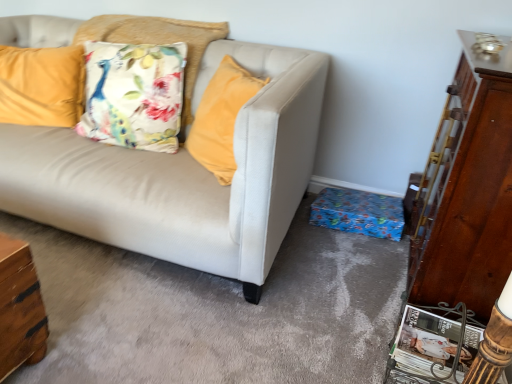
Looking at this image, in order to face floral fabric pillow at upper left, the first pillow viewed from the right, should I rotate leftwards or rightwards?

You should rotate left by 15.099 degrees.

Consider the image. Measure the distance between point (25, 68) and camera.

The depth of point (25, 68) is 2.17 meters.

In order to click on wooden dresser at right in this screenshot , I will do `click(467, 189)`.

In order to face wooden dresser at right, should I rotate leftwards or rightwards?

Turn right by 27.854 degrees to look at wooden dresser at right.

Locate an element on the screen. The width and height of the screenshot is (512, 384). floral fabric pillow at upper left, which is the 2th pillow from left to right is located at coordinates pyautogui.click(x=158, y=43).

Consider the image. Which object is closer to the camera taking this photo, velvet yellow pillow at upper left, the 2th pillow in the right-to-left sequence, or floral fabric pillow at upper left, the first pillow viewed from the right?

floral fabric pillow at upper left, the first pillow viewed from the right, is more forward.

From the picture: Could you measure the distance between velvet yellow pillow at upper left, the 2th pillow in the right-to-left sequence, and floral fabric pillow at upper left, the first pillow viewed from the right?

velvet yellow pillow at upper left, the 2th pillow in the right-to-left sequence, is 14.18 inches from floral fabric pillow at upper left, the first pillow viewed from the right.

Can you confirm if velvet yellow pillow at upper left, the 2th pillow in the right-to-left sequence, is bigger than floral fabric pillow at upper left, which is the 2th pillow from left to right?

No.

Is velvet yellow pillow at upper left, the 1th pillow from the left, surrounding floral fabric pillow at upper left, the first pillow viewed from the right?

No, floral fabric pillow at upper left, the first pillow viewed from the right, is not inside velvet yellow pillow at upper left, the 1th pillow from the left.

Would you consider floral fabric pillow at upper left, which is the 2th pillow from left to right, to be distant from velvet yellow pillow at upper left, the 2th pillow in the right-to-left sequence?

No, floral fabric pillow at upper left, which is the 2th pillow from left to right, is not far away from velvet yellow pillow at upper left, the 2th pillow in the right-to-left sequence.

Looking at this image, what's the angular difference between floral fabric pillow at upper left, the first pillow viewed from the right, and velvet yellow pillow at upper left, the 1th pillow from the left,'s facing directions?

The angle between the facing direction of floral fabric pillow at upper left, the first pillow viewed from the right, and the facing direction of velvet yellow pillow at upper left, the 1th pillow from the left, is 14.2 degrees.

From a real-world perspective, which is physically below, floral fabric pillow at upper left, which is the 2th pillow from left to right, or velvet yellow pillow at upper left, the 2th pillow in the right-to-left sequence?

In real-world perspective, velvet yellow pillow at upper left, the 2th pillow in the right-to-left sequence, is lower.

Is floral fabric pillow at upper left, which is the 2th pillow from left to right, wider or thinner than velvet yellow pillow at upper left, the 2th pillow in the right-to-left sequence?

Considering their sizes, floral fabric pillow at upper left, which is the 2th pillow from left to right, looks broader than velvet yellow pillow at upper left, the 2th pillow in the right-to-left sequence.

From a real-world perspective, is wooden dresser at right above or below floral fabric pillow at upper left, which is the 2th pillow from left to right?

wooden dresser at right is situated lower than floral fabric pillow at upper left, which is the 2th pillow from left to right, in the real world.

Can you confirm if wooden dresser at right is bigger than floral fabric pillow at upper left, which is the 2th pillow from left to right?

Correct, wooden dresser at right is larger in size than floral fabric pillow at upper left, which is the 2th pillow from left to right.

Considering the points (477, 177) and (160, 29), which point is behind, point (477, 177) or point (160, 29)?

The point (160, 29) is more distant.

Are wooden dresser at right and floral fabric pillow at upper left, the first pillow viewed from the right, beside each other?

No, wooden dresser at right is not next to floral fabric pillow at upper left, the first pillow viewed from the right.

How distant is wooden dresser at right from velvet yellow pillow at upper left, the 1th pillow from the left?

wooden dresser at right and velvet yellow pillow at upper left, the 1th pillow from the left, are 1.84 meters apart from each other.

Considering the points (486, 295) and (69, 48), which point is in front, point (486, 295) or point (69, 48)?

The point (486, 295) is in front.

Find the location of a particular element. This screenshot has height=384, width=512. dresser in front of the velvet yellow pillow at upper left, the 1th pillow from the left is located at coordinates pyautogui.click(x=467, y=189).

Is velvet yellow pillow at upper left, the 1th pillow from the left, surrounded by wooden dresser at right?

That's incorrect, velvet yellow pillow at upper left, the 1th pillow from the left, is not inside wooden dresser at right.

From the image's perspective, between velvet yellow pillow at upper left, the 2th pillow in the right-to-left sequence, and wooden dresser at right, who is located below?

From the image's view, wooden dresser at right is below.

Which object is wider, velvet yellow pillow at upper left, the 2th pillow in the right-to-left sequence, or wooden dresser at right?

Wider between the two is velvet yellow pillow at upper left, the 2th pillow in the right-to-left sequence.

Considering the relative sizes of velvet yellow pillow at upper left, the 1th pillow from the left, and wooden dresser at right in the image provided, is velvet yellow pillow at upper left, the 1th pillow from the left, bigger than wooden dresser at right?

No.

Does point (75, 61) come closer to viewer compared to point (504, 280)?

No, (75, 61) is further to viewer.

Is floral fabric pillow at upper left, which is the 2th pillow from left to right, far away from wooden dresser at right?

Absolutely, floral fabric pillow at upper left, which is the 2th pillow from left to right, is distant from wooden dresser at right.

Which is behind, point (214, 24) or point (489, 302)?

The point (214, 24) is farther from the camera.

From a real-world perspective, does floral fabric pillow at upper left, the first pillow viewed from the right, stand above wooden dresser at right?

Yes, from a real-world perspective, floral fabric pillow at upper left, the first pillow viewed from the right, is over wooden dresser at right

Is floral fabric pillow at upper left, the first pillow viewed from the right, taller than wooden dresser at right?

No, floral fabric pillow at upper left, the first pillow viewed from the right, is not taller than wooden dresser at right.

At what (x,y) coordinates should I click in order to perform the action: click on pillow in front of the velvet yellow pillow at upper left, the 1th pillow from the left. Please return your answer as a coordinate pair (x, y). Looking at the image, I should click on pyautogui.click(x=158, y=43).

The width and height of the screenshot is (512, 384). I want to click on pillow that is on the right side of velvet yellow pillow at upper left, the 1th pillow from the left, so (x=158, y=43).

When comparing their distances from velvet yellow pillow at upper left, the 2th pillow in the right-to-left sequence, does floral fabric pillow at upper left, which is the 2th pillow from left to right, or wooden dresser at right seem closer?

Among the two, floral fabric pillow at upper left, which is the 2th pillow from left to right, is located nearer to velvet yellow pillow at upper left, the 2th pillow in the right-to-left sequence.

Considering their positions, is wooden dresser at right positioned closer to velvet yellow pillow at upper left, the 2th pillow in the right-to-left sequence, than floral fabric pillow at upper left, the first pillow viewed from the right?

Based on the image, floral fabric pillow at upper left, the first pillow viewed from the right, appears to be nearer to velvet yellow pillow at upper left, the 2th pillow in the right-to-left sequence.

Estimate the real-world distances between objects in this image. Which object is closer to floral fabric pillow at upper left, the first pillow viewed from the right, wooden dresser at right or velvet yellow pillow at upper left, the 1th pillow from the left?

velvet yellow pillow at upper left, the 1th pillow from the left.

From the image, which object appears to be nearer to wooden dresser at right, velvet yellow pillow at upper left, the 2th pillow in the right-to-left sequence, or floral fabric pillow at upper left, the first pillow viewed from the right?

floral fabric pillow at upper left, the first pillow viewed from the right, is positioned closer to the anchor wooden dresser at right.

Which object lies nearer to the anchor point wooden dresser at right, floral fabric pillow at upper left, which is the 2th pillow from left to right, or velvet yellow pillow at upper left, the 2th pillow in the right-to-left sequence?

floral fabric pillow at upper left, which is the 2th pillow from left to right, lies closer to wooden dresser at right than the other object.

When comparing their distances from floral fabric pillow at upper left, which is the 2th pillow from left to right, does velvet yellow pillow at upper left, the 1th pillow from the left, or wooden dresser at right seem closer?

velvet yellow pillow at upper left, the 1th pillow from the left.

This screenshot has width=512, height=384. In order to click on pillow located between velvet yellow pillow at upper left, the 2th pillow in the right-to-left sequence, and wooden dresser at right in the left-right direction in this screenshot , I will do `click(158, 43)`.